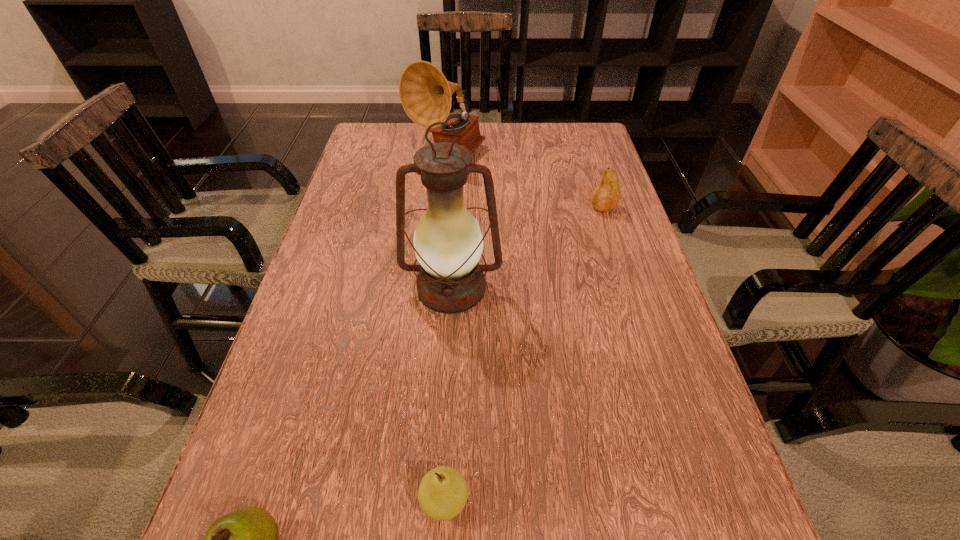
Find the location of a particular element. vacant space that satisfies the following two spatial constraints: 1. on the back side of the tallest object; 2. on the right side of the farthest pear is located at coordinates (456, 207).

Locate an element on the screen. The image size is (960, 540). vacant space that satisfies the following two spatial constraints: 1. on the horn of the second tallest object; 2. on the right side of the shortest object is located at coordinates (413, 501).

Locate an element on the screen. The height and width of the screenshot is (540, 960). vacant space that satisfies the following two spatial constraints: 1. on the horn of the phonograph record; 2. on the left side of the farthest pear is located at coordinates (442, 207).

This screenshot has width=960, height=540. I want to click on blank space that satisfies the following two spatial constraints: 1. on the horn of the fourth nearest object; 2. on the left side of the phonograph record, so click(x=442, y=207).

The image size is (960, 540). I want to click on blank space that satisfies the following two spatial constraints: 1. on the horn of the farthest object; 2. on the right side of the shortest pear, so click(413, 501).